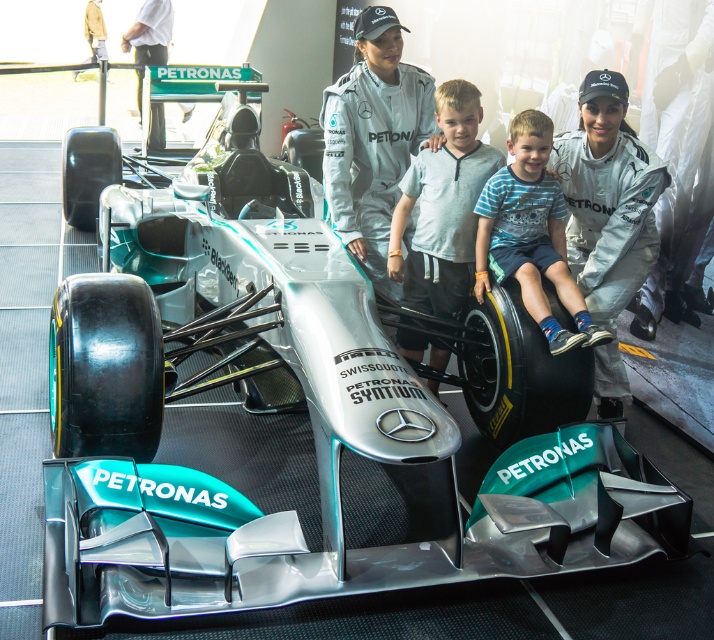
Who is more distant from viewer, (588,326) or (166,36)?

The point (166,36) is behind.

Based on the photo, which of these two, blue striped shirt at center or white fabric shirt at upper left, stands shorter?

blue striped shirt at center

I want to click on blue striped shirt at center, so click(x=531, y=234).

Where is `blue striped shirt at center`? blue striped shirt at center is located at coordinates (531, 234).

Is point (595, 118) positioned behind point (527, 141)?

No, it is in front of (527, 141).

Between point (643, 252) and point (526, 241), which one is positioned in front?

Point (643, 252)

Is point (598, 256) closer to camera compared to point (553, 321)?

No, (598, 256) is behind (553, 321).

The height and width of the screenshot is (640, 714). Identify the location of white matte racing suit at center. (608, 216).

Which is in front, point (393, 212) or point (558, 333)?

Point (558, 333) is more forward.

Is light gray cotton shirt at center taller than blue striped shirt at center?

Yes, light gray cotton shirt at center is taller than blue striped shirt at center.

The image size is (714, 640). What do you see at coordinates (443, 205) in the screenshot? I see `light gray cotton shirt at center` at bounding box center [443, 205].

At what (x,y) coordinates should I click in order to perform the action: click on light gray cotton shirt at center. Please return your answer as a coordinate pair (x, y). Image resolution: width=714 pixels, height=640 pixels. Looking at the image, I should click on (443, 205).